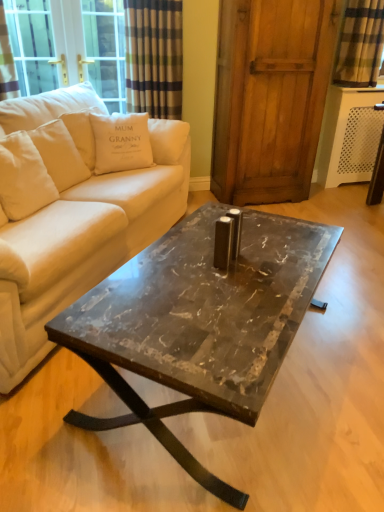
Consider the image. What is the approximate width of wooden screen door at center?

wooden screen door at center is 17.50 inches in width.

In order to face white cotton cushion at upper left, which is the first pillow from right to left, should I rotate leftwards or rightwards?

To face it directly, rotate left by 9.490 degrees.

You are a GUI agent. You are given a task and a screenshot of the screen. Output one action in this format:
    pyautogui.click(x=<x>, y=<y>)
    Task: Click on the beige fabric couch at center
    The height and width of the screenshot is (512, 384).
    Given the screenshot: What is the action you would take?
    pyautogui.click(x=75, y=208)

Measure the distance between point (x=83, y=115) and camera.

A distance of 8.57 feet exists between point (x=83, y=115) and camera.

Image resolution: width=384 pixels, height=512 pixels. I want to click on wooden screen door at center, so click(270, 97).

Which object is wider, beige fabric couch at center or plaid fabric curtain at upper right?

With larger width is beige fabric couch at center.

Is beige fabric couch at center outside of plaid fabric curtain at upper right?

Yes, beige fabric couch at center is located beyond the bounds of plaid fabric curtain at upper right.

Considering the relative sizes of beige fabric couch at center and plaid fabric curtain at upper right in the image provided, is beige fabric couch at center bigger than plaid fabric curtain at upper right?

Indeed, beige fabric couch at center has a larger size compared to plaid fabric curtain at upper right.

Is beige fabric couch at center not close to plaid fabric curtain at upper right?

Yes.

Looking at this image, between plaid fabric curtain at upper right and white cotton cushion at upper left, which is the first pillow from right to left, which one is positioned behind?

Positioned behind is plaid fabric curtain at upper right.

Which of these two, plaid fabric curtain at upper right or white cotton cushion at upper left, which is the first pillow from right to left, stands taller?

plaid fabric curtain at upper right.

Which is more to the left, plaid fabric curtain at upper right or white cotton cushion at upper left, which is the first pillow from right to left?

Positioned to the left is white cotton cushion at upper left, which is the first pillow from right to left.

From the image's perspective, relative to white cotton cushion at upper left, which is the first pillow from right to left, is plaid fabric curtain at upper right above or below?

From the image's perspective, plaid fabric curtain at upper right appears above white cotton cushion at upper left, which is the first pillow from right to left.

Find the location of a particular element. This screenshot has width=384, height=512. screen door below the plaid fabric curtain at upper right (from a real-world perspective) is located at coordinates (270, 97).

Does plaid fabric curtain at upper right have a larger size compared to wooden screen door at center?

Incorrect, plaid fabric curtain at upper right is not larger than wooden screen door at center.

Measure the distance between plaid fabric curtain at upper right and wooden screen door at center.

They are 56.12 centimeters apart.

Does plaid fabric curtain at upper right lie in front of wooden screen door at center?

That is False.

Which of these two, beige fabric couch at center or marble/black at center, stands shorter?

With less height is marble/black at center.

Does point (117, 236) lie behind point (88, 347)?

That is True.

Is beige fabric couch at center in front of or behind marble/black at center in the image?

Clearly, beige fabric couch at center is behind marble/black at center.

Is plaid fabric curtain at upper right looking in the opposite direction of marble/black at center?

plaid fabric curtain at upper right does not have its back to marble/black at center.

Which of these two, plaid fabric curtain at upper right or marble/black at center, stands shorter?

Standing shorter between the two is marble/black at center.

From the image's perspective, is plaid fabric curtain at upper right located above or below marble/black at center?

Clearly, from the image's perspective, plaid fabric curtain at upper right is above marble/black at center.

Which is more to the left, plaid fabric curtain at upper right or marble/black at center?

Positioned to the left is marble/black at center.

Is marble/black at center directly adjacent to white cotton pillow at upper left, which appears as the first pillow when viewed from the left?

They are not placed beside each other.

Does point (307, 288) lie behind point (97, 112)?

No, (307, 288) is closer to viewer.

From the picture: Is marble/black at center not within white cotton pillow at upper left, which appears as the first pillow when viewed from the left?

Yes.

Is marble/black at center thinner than white cotton pillow at upper left, which ranks as the second pillow in right-to-left order?

No.

From the image's perspective, is white cotton pillow at upper left, which appears as the first pillow when viewed from the left, located above or below marble/black at center?

From the image's perspective, white cotton pillow at upper left, which appears as the first pillow when viewed from the left, appears above marble/black at center.

Is marble/black at center at the back of white cotton pillow at upper left, which appears as the first pillow when viewed from the left?

No, marble/black at center is not at the back of white cotton pillow at upper left, which appears as the first pillow when viewed from the left.

Which is closer, (x=78, y=126) or (x=176, y=445)?

Point (x=78, y=126) is farther from the camera than point (x=176, y=445).

In the image, there is a beige fabric couch at center. Where is `curtain above it (from the image's perspective)`? This screenshot has width=384, height=512. curtain above it (from the image's perspective) is located at coordinates (360, 44).

From the image's perspective, starting from the plaid fabric curtain at upper right, which pillow is the 2nd one below? Please provide its 2D coordinates.

[(121, 142)]

Based on their spatial positions, is wooden screen door at center or white cotton cushion at upper left, arranged as the second pillow when viewed from the left, further from marble/black at center?

Result: Among the two, wooden screen door at center is located further to marble/black at center.

When comparing their distances from wooden screen door at center, does white cotton pillow at upper left, which appears as the first pillow when viewed from the left, or plaid fabric curtain at upper right seem closer?

plaid fabric curtain at upper right lies closer to wooden screen door at center than the other object.

Looking at the image, which one is located closer to white cotton pillow at upper left, which ranks as the second pillow in right-to-left order, white cotton cushion at upper left, arranged as the second pillow when viewed from the left, or plaid fabric curtain at upper right?

white cotton cushion at upper left, arranged as the second pillow when viewed from the left, is positioned closer to the anchor white cotton pillow at upper left, which ranks as the second pillow in right-to-left order.

Considering their positions, is white cotton cushion at upper left, arranged as the second pillow when viewed from the left, positioned further to marble/black at center than wooden screen door at center?

The object further to marble/black at center is wooden screen door at center.

Considering their positions, is beige fabric couch at center positioned further to marble/black at center than plaid fabric curtain at upper right?

Among the two, plaid fabric curtain at upper right is located further to marble/black at center.

Estimate the real-world distances between objects in this image. Which object is further from wooden screen door at center, white cotton cushion at upper left, which is the first pillow from right to left, or beige fabric couch at center?

The object further to wooden screen door at center is beige fabric couch at center.

Looking at this image, looking at the image, which one is located closer to white cotton cushion at upper left, arranged as the second pillow when viewed from the left, beige fabric couch at center or white cotton pillow at upper left, which appears as the first pillow when viewed from the left?

Among the two, white cotton pillow at upper left, which appears as the first pillow when viewed from the left, is located nearer to white cotton cushion at upper left, arranged as the second pillow when viewed from the left.

Considering their positions, is marble/black at center positioned closer to white cotton pillow at upper left, which ranks as the second pillow in right-to-left order, than white cotton cushion at upper left, which is the first pillow from right to left?

white cotton cushion at upper left, which is the first pillow from right to left, lies closer to white cotton pillow at upper left, which ranks as the second pillow in right-to-left order, than the other object.

Find the location of a particular element. This screenshot has height=512, width=384. pillow between white cotton pillow at upper left, which appears as the first pillow when viewed from the left, and plaid fabric curtain at upper right from left to right is located at coordinates (121, 142).

Image resolution: width=384 pixels, height=512 pixels. Find the location of `pillow between beige fabric couch at center and white cotton cushion at upper left, which is the first pillow from right to left, from front to back`. pillow between beige fabric couch at center and white cotton cushion at upper left, which is the first pillow from right to left, from front to back is located at coordinates (82, 134).

This screenshot has height=512, width=384. Find the location of `studio couch between marble/black at center and white cotton cushion at upper left, which is the first pillow from right to left, from front to back`. studio couch between marble/black at center and white cotton cushion at upper left, which is the first pillow from right to left, from front to back is located at coordinates (x=75, y=208).

This screenshot has width=384, height=512. Identify the location of screen door situated between white cotton pillow at upper left, which appears as the first pillow when viewed from the left, and plaid fabric curtain at upper right from left to right. (270, 97).